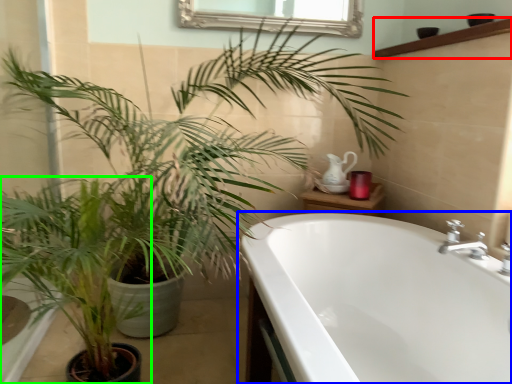
Question: Based on their relative distances, which object is nearer to balustrade (highlighted by a red box)? Choose from bathtub (highlighted by a blue box) and houseplant (highlighted by a green box).

Choices:
 (A) bathtub
 (B) houseplant

Answer: (A)